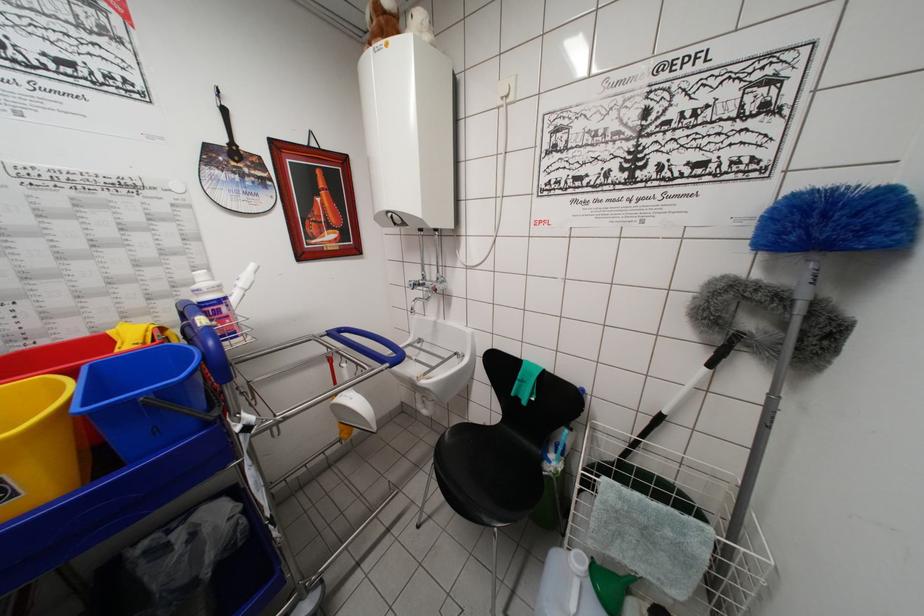
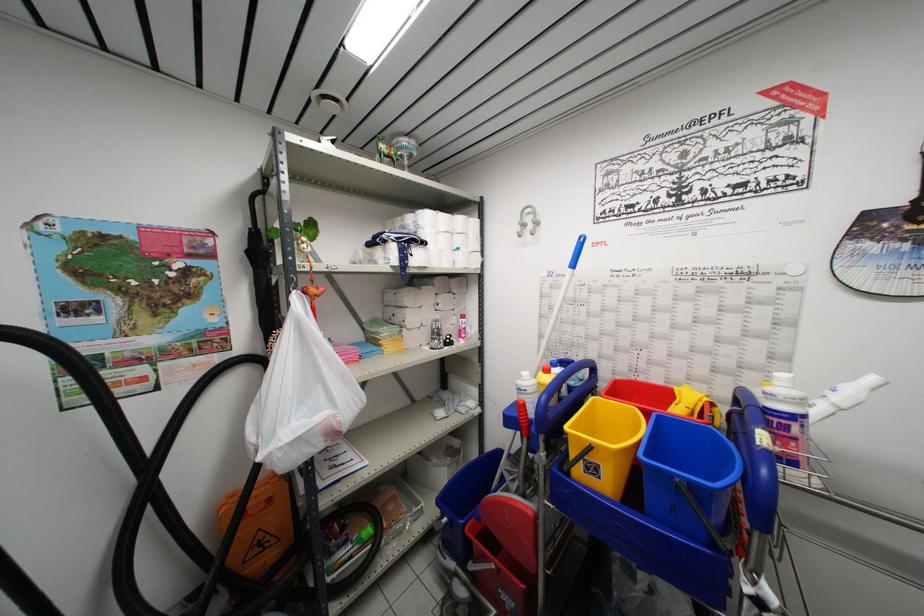
The point at (136, 405) is marked in the first image. Where is the corresponding point in the second image?

(675, 479)